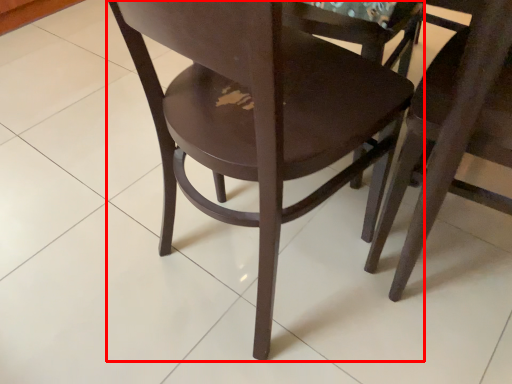
Question: Observing the image, what is the correct spatial positioning of chair (annotated by the red box) in reference to chair?

Choices:
 (A) right
 (B) left

Answer: (B)